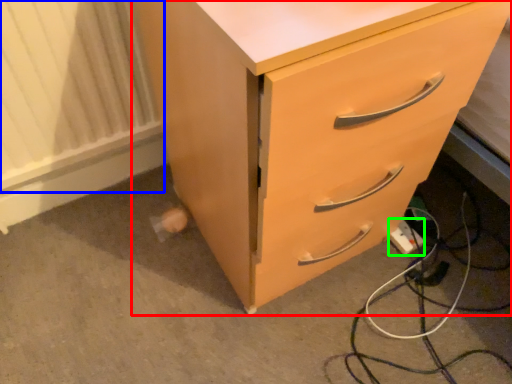
Question: Based on their relative distances, which object is nearer to chest of drawers (highlighted by a red box)? Choose from radiator (highlighted by a blue box) and extension cord (highlighted by a green box).

Choices:
 (A) radiator
 (B) extension cord

Answer: (A)